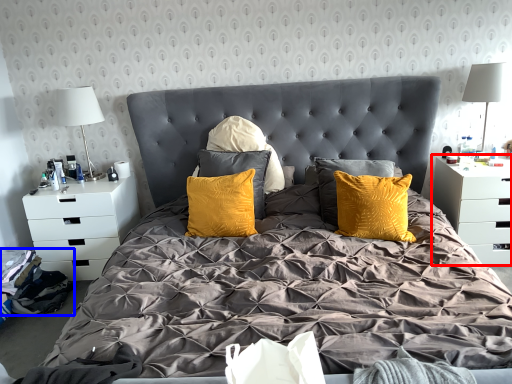
Question: Which object is closer to the camera taking this photo, nightstand (highlighted by a red box) or material (highlighted by a blue box)?

Choices:
 (A) nightstand
 (B) material

Answer: (B)